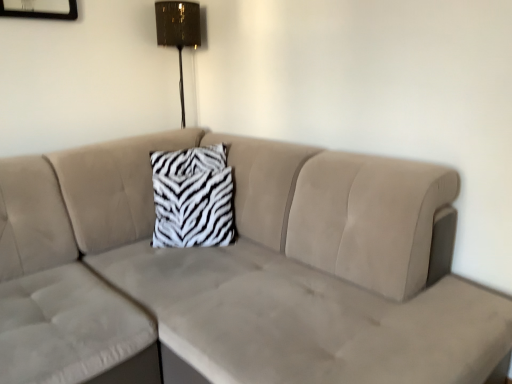
Question: Is metallic gold lampshade at upper center next to beige velvety couch at center?

Choices:
 (A) no
 (B) yes

Answer: (A)

Question: From a real-world perspective, is metallic gold lampshade at upper center beneath beige velvety couch at center?

Choices:
 (A) no
 (B) yes

Answer: (A)

Question: Is metallic gold lampshade at upper center bigger than beige velvety couch at center?

Choices:
 (A) no
 (B) yes

Answer: (A)

Question: Is metallic gold lampshade at upper center outside beige velvety couch at center?

Choices:
 (A) no
 (B) yes

Answer: (B)

Question: Does metallic gold lampshade at upper center contain beige velvety couch at center?

Choices:
 (A) yes
 (B) no

Answer: (B)

Question: Relative to metallic gold lampshade at upper center, is zebra-patterned fabric pillow at center in front or behind?

Choices:
 (A) behind
 (B) front

Answer: (B)

Question: From a real-world perspective, relative to metallic gold lampshade at upper center, is zebra-patterned fabric pillow at center vertically above or below?

Choices:
 (A) below
 (B) above

Answer: (A)

Question: In the image, is zebra-patterned fabric pillow at center on the left side or the right side of metallic gold lampshade at upper center?

Choices:
 (A) right
 (B) left

Answer: (A)

Question: In terms of width, does zebra-patterned fabric pillow at center look wider or thinner when compared to metallic gold lampshade at upper center?

Choices:
 (A) thin
 (B) wide

Answer: (B)

Question: Would you say beige velvety couch at center is to the left or to the right of zebra-patterned fabric pillow at center in the picture?

Choices:
 (A) right
 (B) left

Answer: (A)

Question: Considering the positions of beige velvety couch at center and zebra-patterned fabric pillow at center in the image, is beige velvety couch at center bigger or smaller than zebra-patterned fabric pillow at center?

Choices:
 (A) big
 (B) small

Answer: (A)

Question: Considering the positions of beige velvety couch at center and zebra-patterned fabric pillow at center in the image, is beige velvety couch at center taller or shorter than zebra-patterned fabric pillow at center?

Choices:
 (A) short
 (B) tall

Answer: (B)

Question: In the image, is beige velvety couch at center positioned in front of or behind zebra-patterned fabric pillow at center?

Choices:
 (A) front
 (B) behind

Answer: (A)

Question: Visually, is metallic gold lampshade at upper center positioned to the left or to the right of zebra-patterned fabric pillow at center?

Choices:
 (A) left
 (B) right

Answer: (A)

Question: Is metallic gold lampshade at upper center taller or shorter than zebra-patterned fabric pillow at center?

Choices:
 (A) short
 (B) tall

Answer: (B)